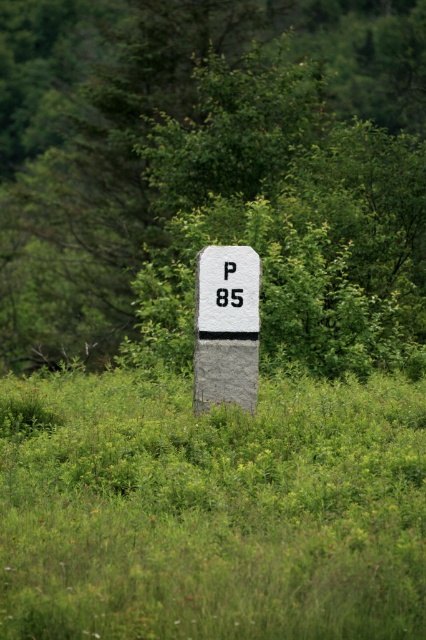
Question: Does green leafy tree at center have a larger size compared to green grassy at center?

Choices:
 (A) yes
 (B) no

Answer: (A)

Question: Which of the following is the closest to the observer?

Choices:
 (A) (324, 157)
 (B) (238, 259)

Answer: (B)

Question: Which point is closer to the camera?

Choices:
 (A) (204, 630)
 (B) (250, 342)
 (C) (391, 17)
 (D) (229, 291)

Answer: (A)

Question: Which object is the farthest from the green leafy tree at center?

Choices:
 (A) black plastic number at center
 (B) gray stone sign at center

Answer: (A)

Question: Does green leafy tree at center appear under gray stone sign at center?

Choices:
 (A) no
 (B) yes

Answer: (A)

Question: Is gray stone sign at center wider than black plastic number at center?

Choices:
 (A) no
 (B) yes

Answer: (B)